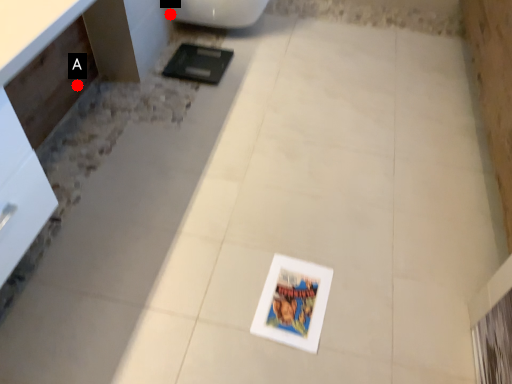
Question: Two points are circled on the image, labeled by A and B beside each circle. Which point is further to the camera?

Choices:
 (A) A is further
 (B) B is further

Answer: (B)